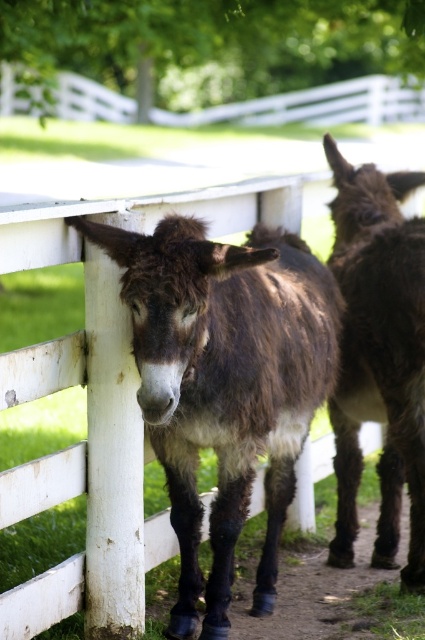
You are a farmer checking the fence for damage. You notice the brown fuzzy donkey at center and the white wooden rail at upper center. Which object is bigger in size?

The brown fuzzy donkey at center is larger in size compared to the white wooden rail at upper center according to the description.

You are a farmer who wants to separate the brown fuzzy donkey at center and the brown fuzzy mule at center with a divider. Since the divider can only be placed between them, where should you place it?

The divider should be placed between the brown fuzzy donkey at center and the brown fuzzy mule at center, as the brown fuzzy donkey at center is positioned on the left side of the brown fuzzy mule at center.

You are a farmer checking the fence for structural integrity. You notice the brown fuzzy donkey at center and the white wooden rail at upper center. Which object is positioned higher in the image?

The white wooden rail at upper center is positioned higher than the brown fuzzy donkey at center.